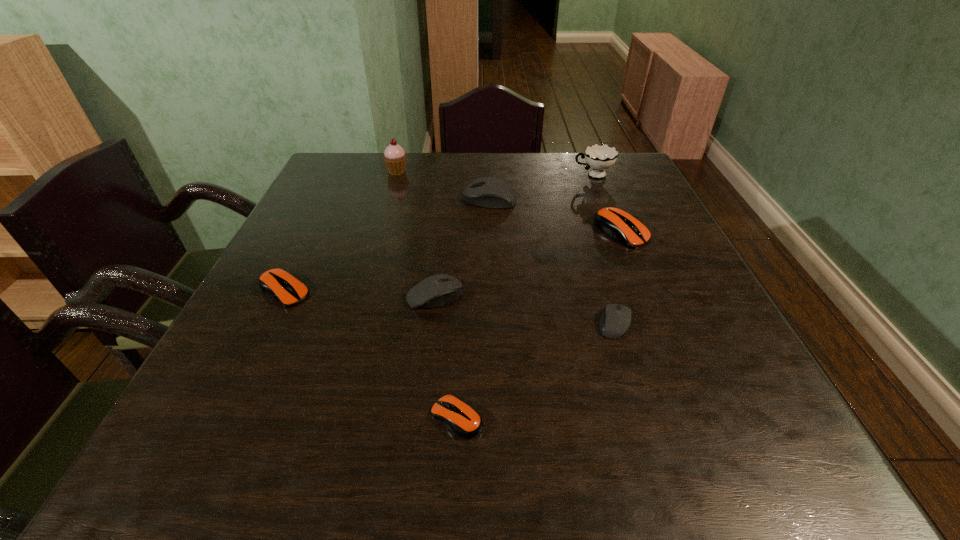
Locate an element on the screen. the leftmost computer mouse is located at coordinates click(x=279, y=284).

Where is `the rightmost black computer equipment`? The height and width of the screenshot is (540, 960). the rightmost black computer equipment is located at coordinates (615, 321).

This screenshot has width=960, height=540. Identify the location of the second orange computer mouse from left to right. (462, 419).

Locate an element on the screen. the shortest computer mouse is located at coordinates (462, 419).

The image size is (960, 540). What are the coordinates of `free space located 0.090m on the left of the cupcake` in the screenshot? It's located at (355, 171).

Identify the location of free spot located 0.300m on the side of the white cup with the handle. This screenshot has height=540, width=960. (471, 176).

Where is `blank space located on the side of the white cup with the handle`? The image size is (960, 540). blank space located on the side of the white cup with the handle is located at coordinates pos(471,176).

Locate an element on the screen. vacant space located 0.090m on the side of the white cup with the handle is located at coordinates (542, 176).

Find the location of a particular element. The height and width of the screenshot is (540, 960). vacant region located on the right of the biggest black computer equipment is located at coordinates (546, 199).

Identify the location of vacant space located on the front of the fifth nearest computer mouse. The height and width of the screenshot is (540, 960). (654, 310).